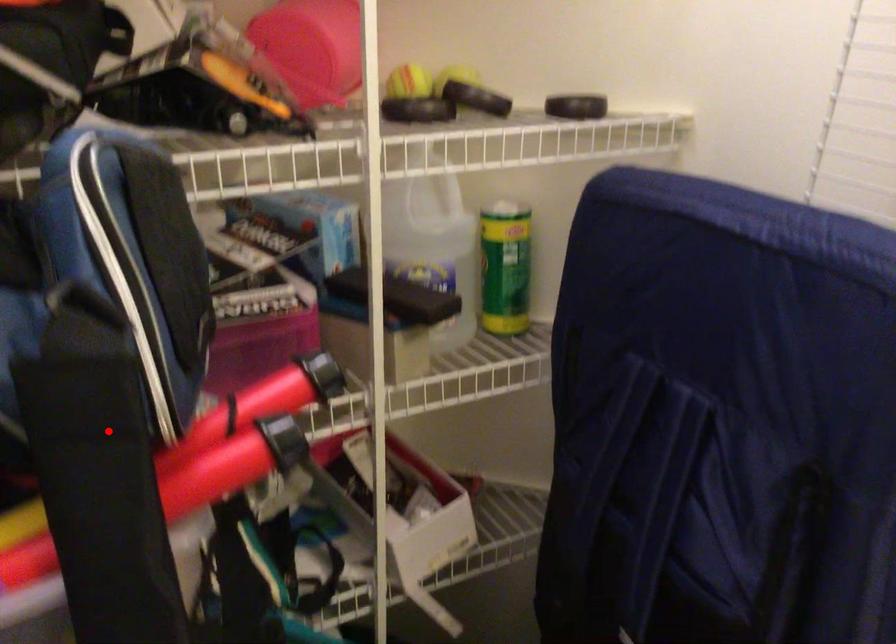
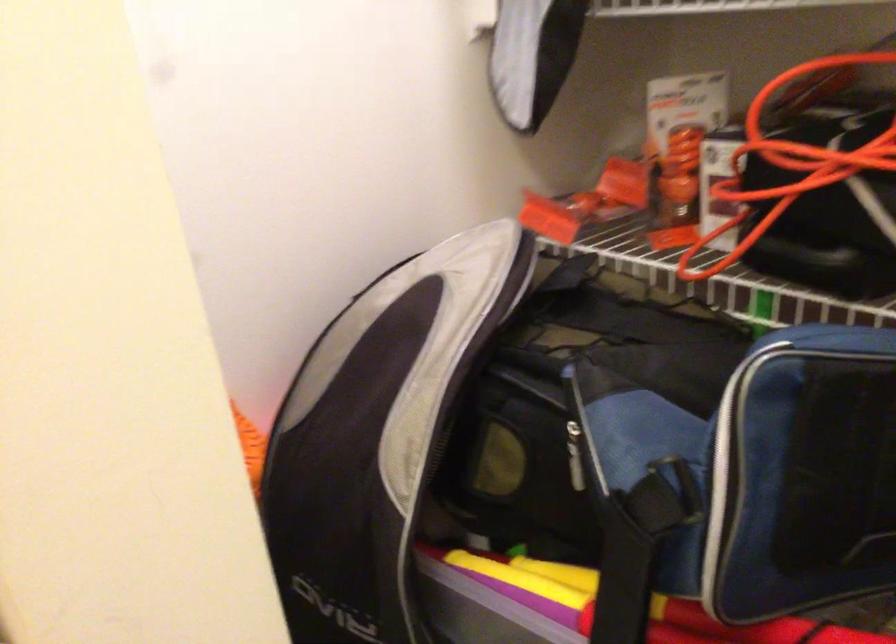
Question: I am providing you with two images of the same scene from different viewpoints. Given a red point in image1, look at the same physical point in image2. Is it:

Choices:
 (A) Closer to the viewpoint
 (B) Farther from the viewpoint

Answer: (B)